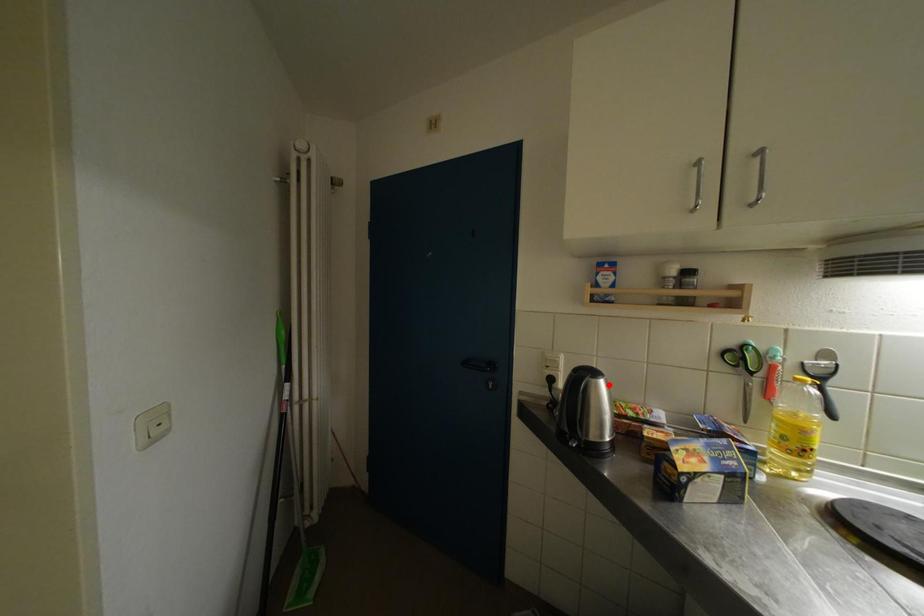
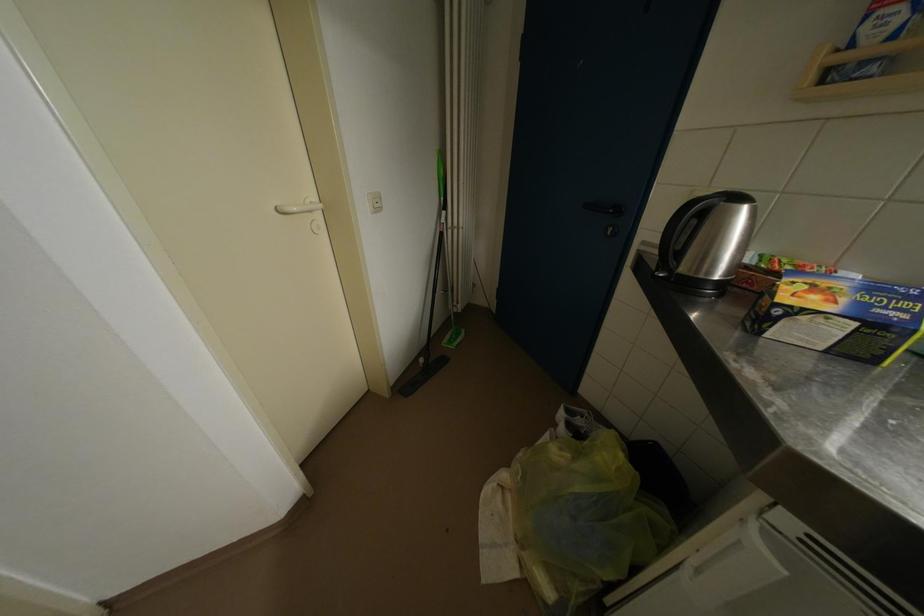
Where in the second image is the point corresponding to the highlighted location from the first image?

(752, 213)